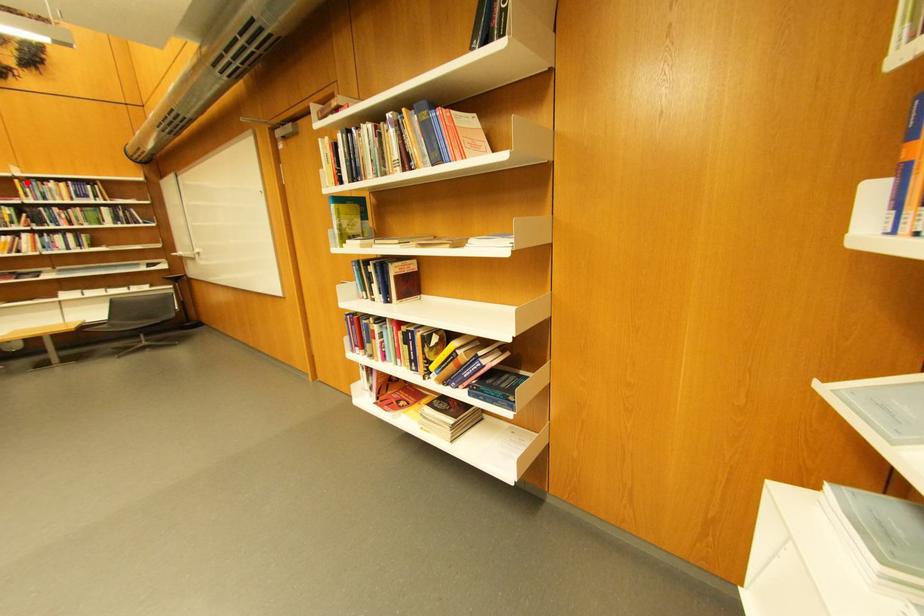
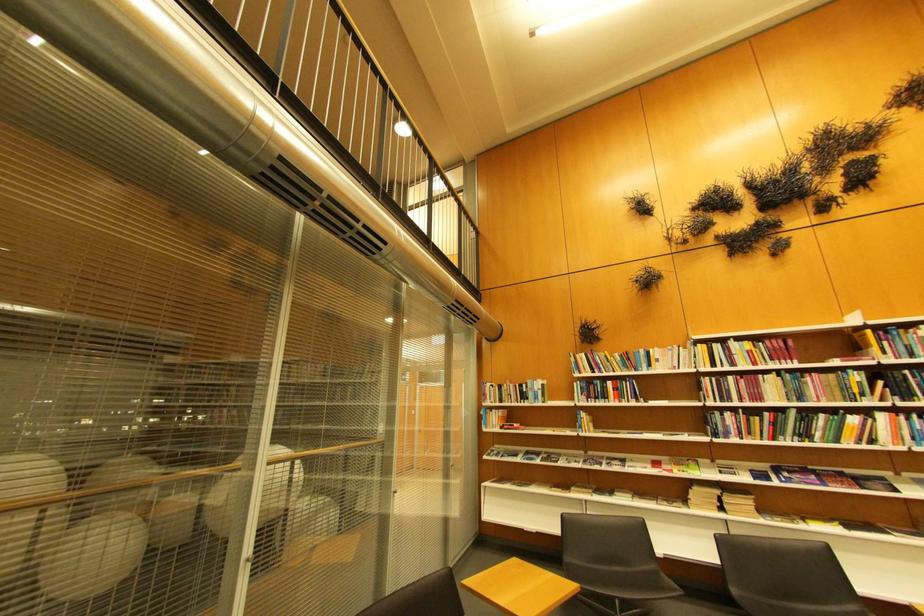
Question: I am providing you with two images of the same scene from different viewpoints. In image1, a red point is highlighted. Considering the same 3D point in image2, which of the following is correct?

Choices:
 (A) It is closer
 (B) It is farther

Answer: (A)